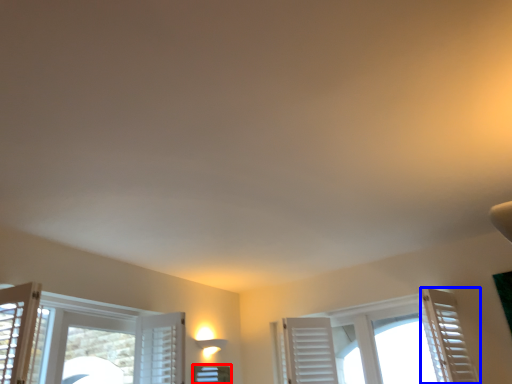
Question: Which object appears closest to the camera in this image, window (highlighted by a red box) or curtain (highlighted by a blue box)?

Choices:
 (A) window
 (B) curtain

Answer: (B)